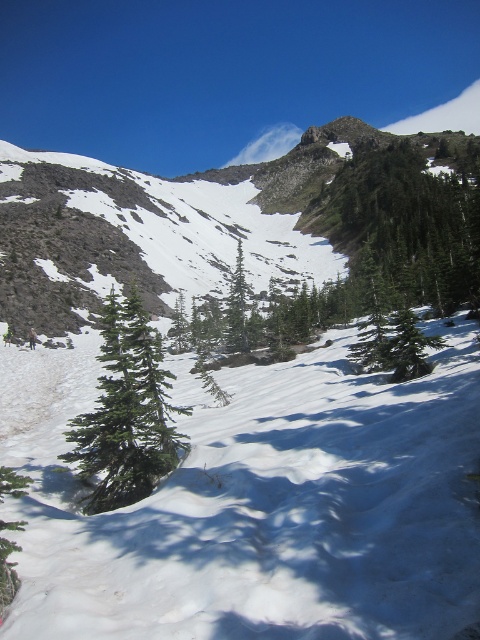
Question: Does green textured tree at upper center come behind green matte evergreen tree at center?

Choices:
 (A) no
 (B) yes

Answer: (B)

Question: Which of these objects is positioned farthest from the green matte tree at center?

Choices:
 (A) green textured tree at upper center
 (B) green matte evergreen tree at center
 (C) white snow at center

Answer: (C)

Question: Which of the following is the farthest from the observer?

Choices:
 (A) green matte evergreen tree at center
 (B) white snow at center

Answer: (A)

Question: Does white snow at center appear on the left side of green textured tree at upper center?

Choices:
 (A) yes
 (B) no

Answer: (A)

Question: Can you confirm if white snow at center is positioned below green textured tree at upper center?

Choices:
 (A) no
 (B) yes

Answer: (B)

Question: Which object is the farthest from the green textured tree at upper center?

Choices:
 (A) green matte tree at center
 (B) green matte evergreen tree at center
 (C) white snow at center

Answer: (C)